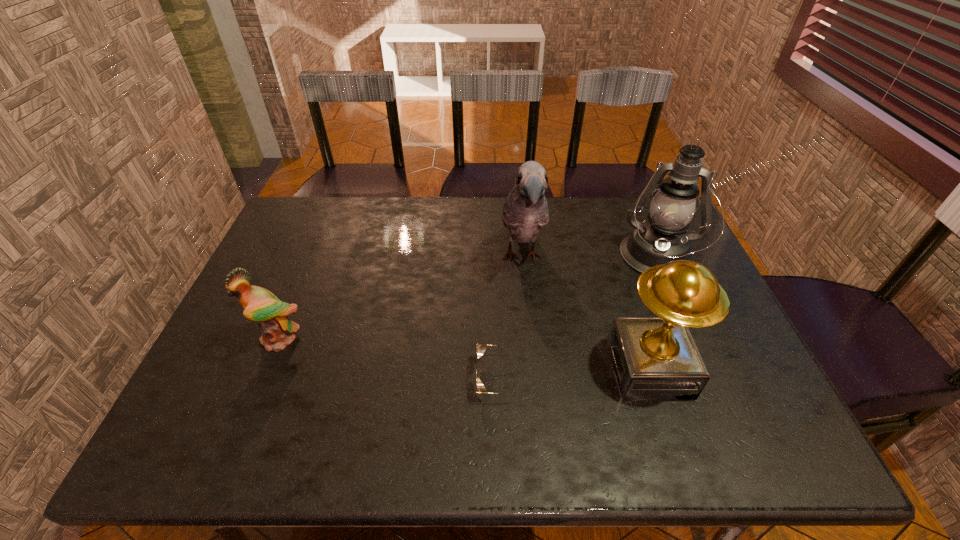
You are a GUI agent. You are given a task and a screenshot of the screen. Output one action in this format:
    pyautogui.click(x=<x>, y=<y>)
    Task: Click on the vacant space located on the front-facing side of the award
    
    Given the screenshot: What is the action you would take?
    pyautogui.click(x=470, y=368)

You are a GUI agent. You are given a task and a screenshot of the screen. Output one action in this format:
    pyautogui.click(x=<x>, y=<y>)
    Task: Click on the vacant region located 0.050m on the front-facing side of the award
    The image size is (960, 540).
    Given the screenshot: What is the action you would take?
    pyautogui.click(x=591, y=368)

This screenshot has width=960, height=540. In order to click on vacant area located on the front-facing side of the nearer parrot in this screenshot , I will do `click(255, 398)`.

Identify the location of vacant space positioned 0.220m on the front lenses of the shortest object. Image resolution: width=960 pixels, height=540 pixels. (383, 378).

Locate an element on the screen. The height and width of the screenshot is (540, 960). vacant region located 0.260m on the front lenses of the shortest object is located at coordinates click(366, 378).

The height and width of the screenshot is (540, 960). In order to click on free space located on the front lenses of the shortest object in this screenshot , I will do `click(392, 378)`.

The height and width of the screenshot is (540, 960). Identify the location of oil lamp present at the far edge. tap(662, 239).

This screenshot has height=540, width=960. I want to click on parrot that is at the far edge, so click(x=525, y=211).

I want to click on object positioned at the left edge, so click(x=259, y=304).

In order to click on oil lamp that is at the right edge in this screenshot , I will do `click(662, 239)`.